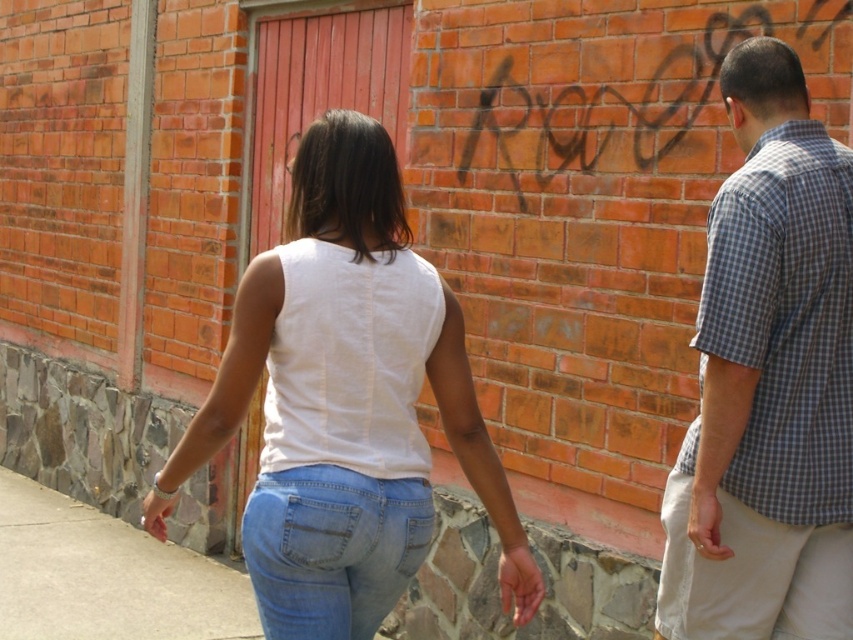
Question: Is checkered fabric shirt at right closer to the viewer compared to gray concrete pavement at lower left?

Choices:
 (A) yes
 (B) no

Answer: (A)

Question: Which point appears closest to the camera in this image?

Choices:
 (A) (45, 616)
 (B) (346, 241)

Answer: (B)

Question: Is checkered fabric shirt at right closer to camera compared to gray concrete pavement at lower left?

Choices:
 (A) no
 (B) yes

Answer: (B)

Question: Which of the following is the farthest from the observer?

Choices:
 (A) gray concrete pavement at lower left
 (B) checkered fabric shirt at right
 (C) white cotton tank top at center

Answer: (A)

Question: Which object is farther from the camera taking this photo?

Choices:
 (A) gray concrete pavement at lower left
 (B) checkered fabric shirt at right

Answer: (A)

Question: Is checkered fabric shirt at right closer to the viewer compared to light blue denim jeans at center?

Choices:
 (A) yes
 (B) no

Answer: (B)